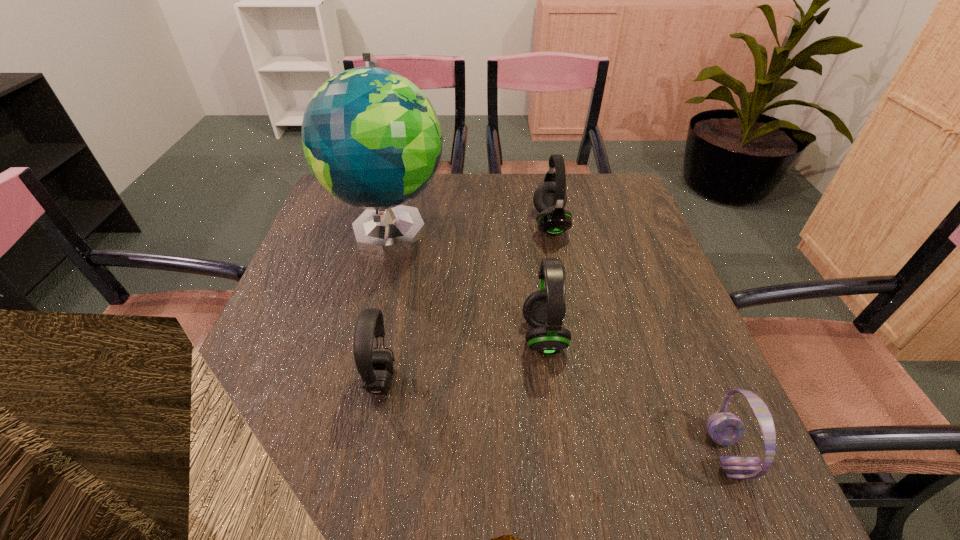
Where is `blank space at the near edge`? blank space at the near edge is located at coordinates (648, 505).

Identify the location of vacant area at the left edge of the desktop. The height and width of the screenshot is (540, 960). (309, 328).

In order to click on free region at the right edge of the desktop in this screenshot , I will do `click(709, 382)`.

Locate an element on the screen. Image resolution: width=960 pixels, height=540 pixels. free space at the near left corner of the desktop is located at coordinates (258, 473).

Where is `free space at the far right corner`? The width and height of the screenshot is (960, 540). free space at the far right corner is located at coordinates (588, 180).

This screenshot has width=960, height=540. Identify the location of free space between the leftmost headset and the nearest object. (554, 417).

Where is `vacant space that is in between the farthest headset and the tallest object`? This screenshot has width=960, height=540. vacant space that is in between the farthest headset and the tallest object is located at coordinates (470, 226).

Identify the location of vacant space in between the leftmost headset and the tallest object. (386, 304).

The image size is (960, 540). In order to click on free spot between the nearest headset and the leftmost headset in this screenshot , I will do `click(554, 417)`.

Where is `vacant area between the globe and the leftmost headset`? vacant area between the globe and the leftmost headset is located at coordinates (386, 304).